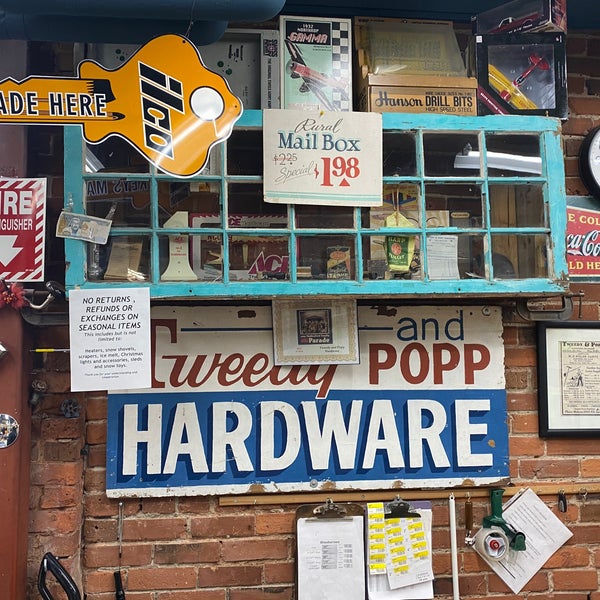
Where is `clip board`? The height and width of the screenshot is (600, 600). clip board is located at coordinates pos(354,510), pos(404,510).